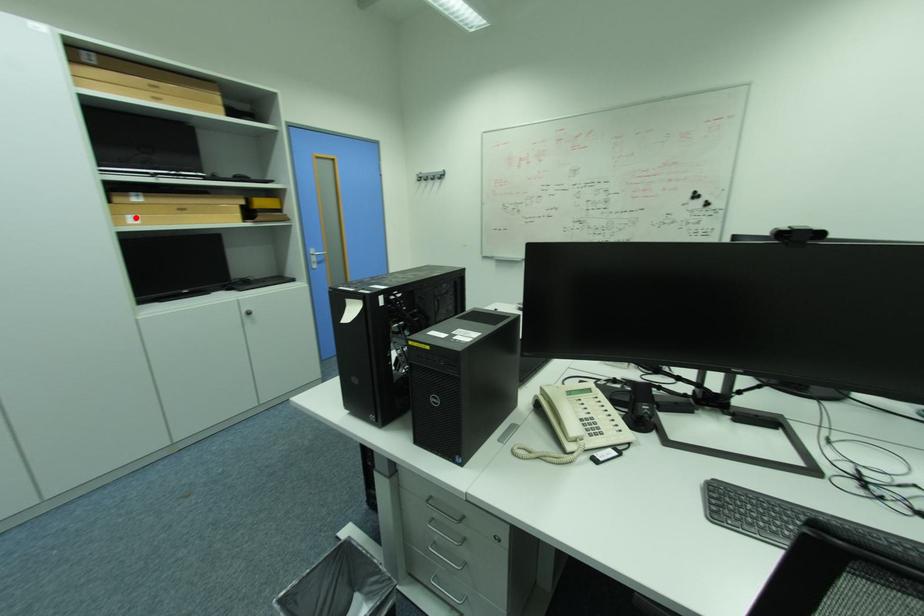
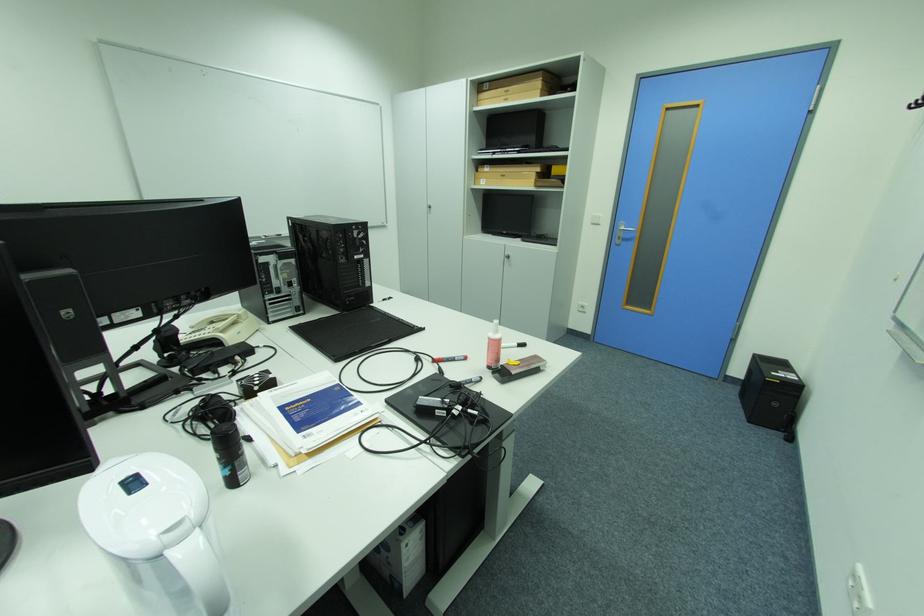
Question: I am providing you with two images of the same scene from different viewpoints. A red point is shown in image1. For the corresponding object point in image2, is it positioned nearer or farther from the camera?

Choices:
 (A) Nearer
 (B) Farther

Answer: (A)